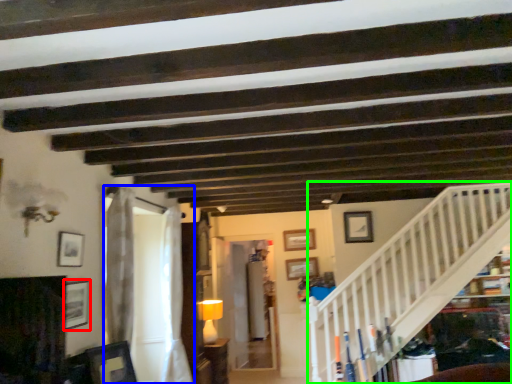
Question: Which is farther away from picture frame (highlighted by a red box)? curtain (highlighted by a blue box) or stairwell (highlighted by a green box)?

Choices:
 (A) curtain
 (B) stairwell

Answer: (B)